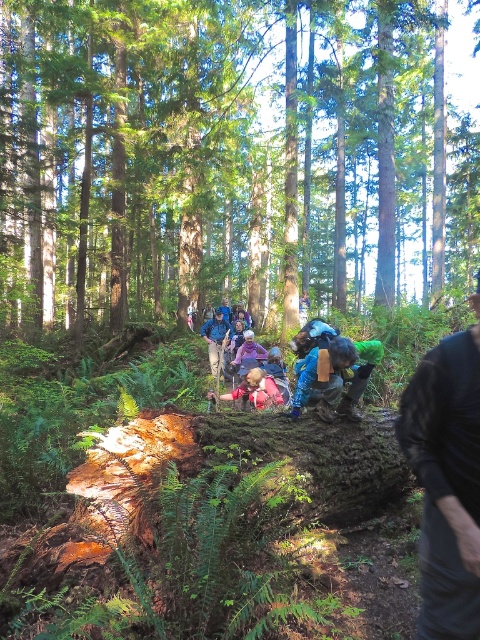
Who is lower down, blue fabric backpack at center or purple fabric at center?

Positioned lower is purple fabric at center.

Which of these two, blue fabric backpack at center or purple fabric at center, stands taller?

purple fabric at center is taller.

Which is behind, point (351, 413) or point (254, 358)?

Positioned behind is point (254, 358).

You are a GUI agent. You are given a task and a screenshot of the screen. Output one action in this format:
    pyautogui.click(x=<x>, y=<y>)
    Task: Click on the blue fabric backpack at center
    
    Given the screenshot: What is the action you would take?
    pyautogui.click(x=323, y=376)

Find the location of a particular element. pink fabric at center is located at coordinates (256, 390).

Where is `pink fabric at center`? The width and height of the screenshot is (480, 640). pink fabric at center is located at coordinates tap(256, 390).

Is blue fabric jacket at center bigger than purple fabric at center?

Yes, blue fabric jacket at center is bigger than purple fabric at center.

Does blue fabric jacket at center come behind purple fabric at center?

That is True.

This screenshot has width=480, height=640. I want to click on blue fabric jacket at center, so click(x=216, y=340).